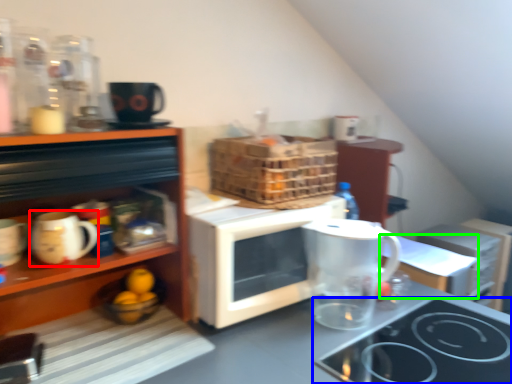
Question: Which is farther away from mug (highlighted by a red box)? gas stove (highlighted by a blue box) or table (highlighted by a green box)?

Choices:
 (A) gas stove
 (B) table

Answer: (B)